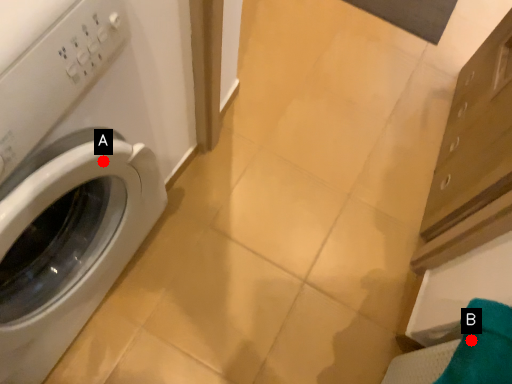
Question: Two points are circled on the image, labeled by A and B beside each circle. Which of the following is the farthest from the observer?

Choices:
 (A) A is further
 (B) B is further

Answer: (B)